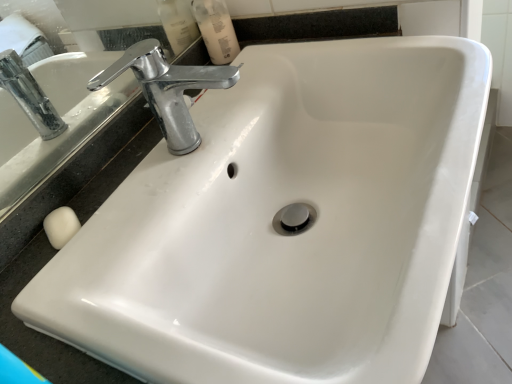
I want to click on free space in front of chrome metallic faucet at upper left, so click(173, 237).